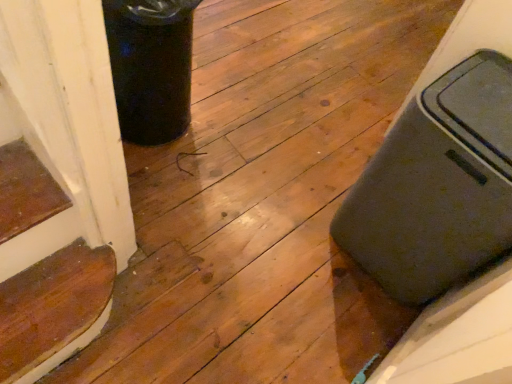
Question: From the image's perspective, is matte gray suitcase at right located above or below wooden stair at lower left?

Choices:
 (A) above
 (B) below

Answer: (A)

Question: From a real-world perspective, relative to wooden stair at lower left, is matte gray suitcase at right vertically above or below?

Choices:
 (A) above
 (B) below

Answer: (A)

Question: Considering the positions of point (379, 279) and point (104, 296), is point (379, 279) closer or farther from the camera than point (104, 296)?

Choices:
 (A) farther
 (B) closer

Answer: (A)

Question: From the image's perspective, relative to matte gray suitcase at right, is wooden stair at lower left above or below?

Choices:
 (A) below
 (B) above

Answer: (A)

Question: Would you say wooden stair at lower left is to the left or to the right of matte gray suitcase at right in the picture?

Choices:
 (A) right
 (B) left

Answer: (B)

Question: Considering the positions of wooden stair at lower left and matte gray suitcase at right in the image, is wooden stair at lower left taller or shorter than matte gray suitcase at right?

Choices:
 (A) tall
 (B) short

Answer: (B)

Question: In terms of size, does wooden stair at lower left appear bigger or smaller than matte gray suitcase at right?

Choices:
 (A) big
 (B) small

Answer: (B)